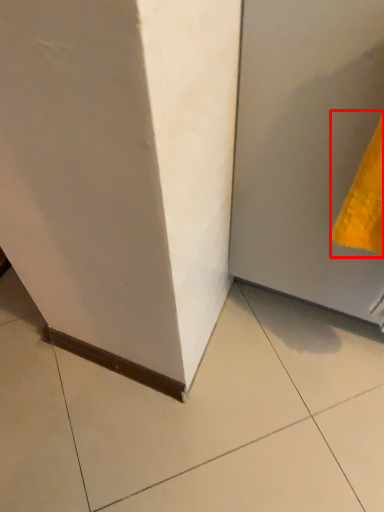
Question: From the image, what is the correct spatial relationship of hand towel (annotated by the red box) in relation to door?

Choices:
 (A) left
 (B) right

Answer: (A)